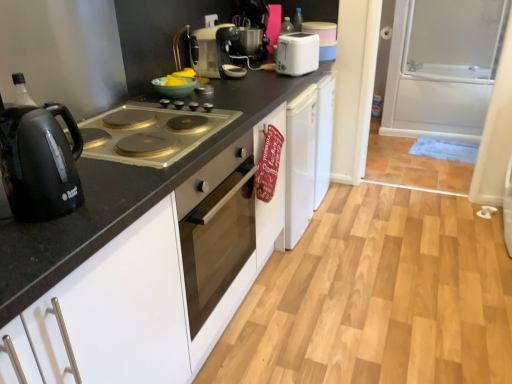
Question: From the image's perspective, is transparent glass screen door at right above or below black matte countertop at center?

Choices:
 (A) above
 (B) below

Answer: (A)

Question: Relative to black matte countertop at center, is transparent glass screen door at right in front or behind?

Choices:
 (A) behind
 (B) front

Answer: (A)

Question: Which is farther from the black matte countertop at center?

Choices:
 (A) matte black oven at center
 (B) transparent glass screen door at right
 (C) white plastic toaster at upper center, the first kitchen appliance from the back
 (D) matte silver toaster at upper center, the 2th kitchen appliance positioned from the front
 (E) matte silver gas stove at left

Answer: (B)

Question: Which of these objects is positioned farthest from the white plastic toaster at upper center, the first kitchen appliance viewed from the right?

Choices:
 (A) matte black oven at center
 (B) black glossy electric kettle at left, placed as the first kitchen appliance when sorted from front to back
 (C) matte silver gas stove at left
 (D) matte silver toaster at upper center, positioned as the 2th kitchen appliance in back-to-front order
 (E) black matte countertop at center

Answer: (B)